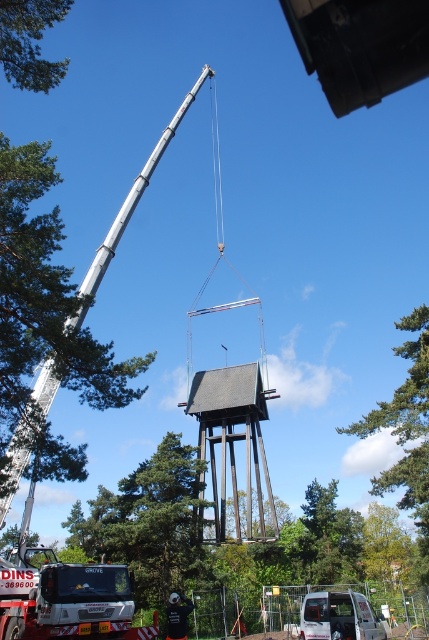
Question: Which of the following is the farthest from the observer?

Choices:
 (A) (416, 381)
 (B) (198, 410)
 (C) (139, 593)
 (D) (94, 573)

Answer: (B)

Question: Does green leafy tree at upper center appear on the left side of silver metallic crane at upper left?

Choices:
 (A) no
 (B) yes

Answer: (A)

Question: Which object is closer to the camera taking this photo?

Choices:
 (A) silver metallic crane at upper left
 (B) green leafy tree at upper left

Answer: (B)

Question: Can you confirm if green leafy tree at upper center is positioned below silver metallic crane at upper left?

Choices:
 (A) yes
 (B) no

Answer: (A)

Question: Which of the following is the farthest from the observer?

Choices:
 (A) silver metallic crane at upper left
 (B) brown wooden tower at center
 (C) green leafy tree at upper center

Answer: (B)

Question: Is brown wooden tower at center to the right of green leafy tree at upper center from the viewer's perspective?

Choices:
 (A) no
 (B) yes

Answer: (A)